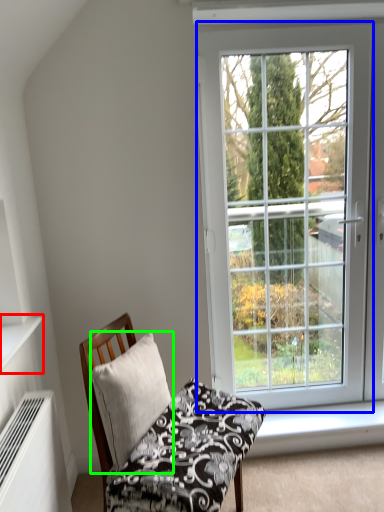
Question: Which object is the farthest from shelf (highlighted by a red box)? Choose among these: window (highlighted by a blue box) or pillow (highlighted by a green box).

Choices:
 (A) window
 (B) pillow

Answer: (A)